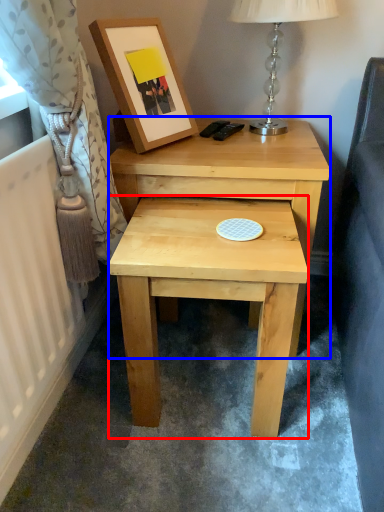
Question: Among these objects, which one is farthest to the camera, stool (highlighted by a red box) or nightstand (highlighted by a blue box)?

Choices:
 (A) stool
 (B) nightstand

Answer: (B)